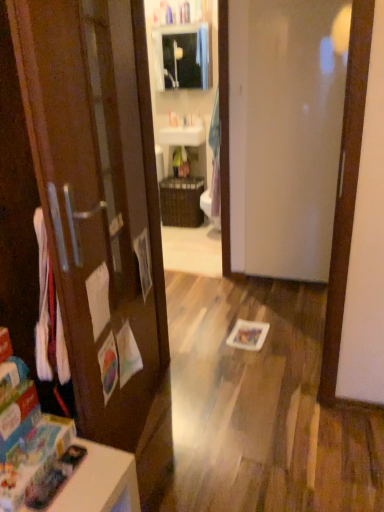
In order to click on white glossy table at lower left in this screenshot , I will do `click(100, 482)`.

What do you see at coordinates (284, 132) in the screenshot? Image resolution: width=384 pixels, height=512 pixels. I see `white glossy door at center` at bounding box center [284, 132].

Describe the element at coordinates (183, 57) in the screenshot. The image size is (384, 512). I see `matte glass medicine cabinet at upper center` at that location.

At what (x,y) coordinates should I click in order to perform the action: click on matte glass medicine cabinet at upper center. Please return your answer as a coordinate pair (x, y). Looking at the image, I should click on (183, 57).

I want to click on white glossy sink at upper center, so click(x=183, y=136).

Can you tell me how much white glossy table at lower left and white glossy door at center differ in facing direction?

The facing directions of white glossy table at lower left and white glossy door at center are 85.2 degrees apart.

Based on the photo, from a real-world perspective, between white glossy table at lower left and white glossy door at center, who is vertically lower?

From a 3D spatial view, white glossy table at lower left is below.

In terms of width, does white glossy table at lower left look wider or thinner when compared to white glossy door at center?

In the image, white glossy table at lower left appears to be wider than white glossy door at center.

Is white glossy table at lower left oriented away from white glossy door at center?

No.

Is white plastic sink at upper center positioned beyond the bounds of white glossy sink at upper center?

Yes, white plastic sink at upper center is outside of white glossy sink at upper center.

Which object is positioned more to the right, white plastic sink at upper center or white glossy sink at upper center?

Positioned to the right is white glossy sink at upper center.

Considering the relative positions of white plastic sink at upper center and white glossy sink at upper center in the image provided, is white plastic sink at upper center in front of white glossy sink at upper center?

That is False.

Does white plastic sink at upper center turn towards white glossy sink at upper center?

No, white plastic sink at upper center is not facing towards white glossy sink at upper center.

From the image's perspective, is white plastic sink at upper center under white glossy table at lower left?

No, from the image's perspective, white plastic sink at upper center is not below white glossy table at lower left.

Is white plastic sink at upper center smaller than white glossy table at lower left?

Indeed, white plastic sink at upper center has a smaller size compared to white glossy table at lower left.

Consider the image. Would you say white plastic sink at upper center is inside or outside white glossy table at lower left?

white plastic sink at upper center is spatially situated outside white glossy table at lower left.

Is white glossy table at lower left at the back of white plastic sink at upper center?

No, white glossy table at lower left is not at the back of white plastic sink at upper center.

Between point (313, 151) and point (204, 77), which one is positioned behind?

The point (204, 77) is farther from the camera.

From a real-world perspective, is white glossy door at center above or below matte glass medicine cabinet at upper center?

white glossy door at center is below matte glass medicine cabinet at upper center.

Considering the positions of objects white glossy door at center and matte glass medicine cabinet at upper center in the image provided, who is more to the right, white glossy door at center or matte glass medicine cabinet at upper center?

white glossy door at center is more to the right.

Does white glossy door at center have a lesser width compared to matte glass medicine cabinet at upper center?

Yes.

Can you confirm if white glossy sink at upper center is taller than matte glass medicine cabinet at upper center?

No, white glossy sink at upper center is not taller than matte glass medicine cabinet at upper center.

Considering the points (205, 129) and (181, 37), which point is behind, point (205, 129) or point (181, 37)?

The point (181, 37) is behind.

From a real-world perspective, is white glossy sink at upper center below matte glass medicine cabinet at upper center?

Correct, in the physical world, white glossy sink at upper center is lower than matte glass medicine cabinet at upper center.

Which object is further away from the camera taking this photo, white glossy sink at upper center or matte glass medicine cabinet at upper center?

Positioned behind is white glossy sink at upper center.

Would you say white glossy sink at upper center is a long distance from white plastic sink at upper center?

They are positioned close to each other.

Locate an element on the screen. The height and width of the screenshot is (512, 384). toiletry located above the white glossy sink at upper center (from the image's perspective) is located at coordinates click(173, 119).

Is white glossy sink at upper center inside the boundaries of white plastic sink at upper center, or outside?

white glossy sink at upper center is located beyond the bounds of white plastic sink at upper center.

Which object is closer to the camera, white glossy sink at upper center or white plastic sink at upper center?

white glossy sink at upper center.

In terms of size, does matte glass medicine cabinet at upper center appear bigger or smaller than white glossy door at center?

matte glass medicine cabinet at upper center is smaller than white glossy door at center.

Is matte glass medicine cabinet at upper center not near white glossy door at center?

Yes, matte glass medicine cabinet at upper center is far from white glossy door at center.

The height and width of the screenshot is (512, 384). What are the coordinates of `medicine cabinet to the left of white glossy door at center` in the screenshot? It's located at (183, 57).

Identify the location of table lying below the white glossy door at center (from the image's perspective). (100, 482).

You are a GUI agent. You are given a task and a screenshot of the screen. Output one action in this format:
    pyautogui.click(x=<x>, y=<y>)
    Task: Click on the toiletry positioned vertically above the white glossy sink at upper center (from a real-world perspective)
    The image size is (384, 512).
    Given the screenshot: What is the action you would take?
    pyautogui.click(x=173, y=119)

Looking at the image, which one is located closer to white glossy door at center, white glossy sink at upper center or white glossy table at lower left?

Among the two, white glossy sink at upper center is located nearer to white glossy door at center.

Which object lies further to the anchor point white glossy table at lower left, white plastic sink at upper center or white glossy door at center?

The object further to white glossy table at lower left is white plastic sink at upper center.

Looking at the image, which one is located further to white glossy table at lower left, matte glass medicine cabinet at upper center or white glossy door at center?

Based on the image, matte glass medicine cabinet at upper center appears to be further to white glossy table at lower left.

Estimate the real-world distances between objects in this image. Which object is further from matte glass medicine cabinet at upper center, white glossy table at lower left or white glossy sink at upper center?

Based on the image, white glossy table at lower left appears to be further to matte glass medicine cabinet at upper center.

Estimate the real-world distances between objects in this image. Which object is further from white glossy sink at upper center, white glossy table at lower left or matte glass medicine cabinet at upper center?

white glossy table at lower left.

Looking at the image, which one is located further to white glossy sink at upper center, white plastic sink at upper center or matte glass medicine cabinet at upper center?

matte glass medicine cabinet at upper center is positioned further to the anchor white glossy sink at upper center.

Based on the photo, which object lies nearer to the anchor point matte glass medicine cabinet at upper center, white glossy sink at upper center or white plastic sink at upper center?

white plastic sink at upper center.

Considering their positions, is matte glass medicine cabinet at upper center positioned closer to white glossy door at center than white glossy sink at upper center?

The object closer to white glossy door at center is white glossy sink at upper center.

The image size is (384, 512). Find the location of `medicine cabinet between white glossy door at center and white glossy sink at upper center in the front-back direction`. medicine cabinet between white glossy door at center and white glossy sink at upper center in the front-back direction is located at coordinates (183, 57).

The image size is (384, 512). What are the coordinates of `counter top positioned between white glossy door at center and white plastic sink at upper center from near to far` in the screenshot? It's located at (183, 136).

The image size is (384, 512). Identify the location of door between white glossy table at lower left and matte glass medicine cabinet at upper center along the z-axis. click(284, 132).

Identify the location of door between white glossy table at lower left and white plastic sink at upper center in the front-back direction. (284, 132).